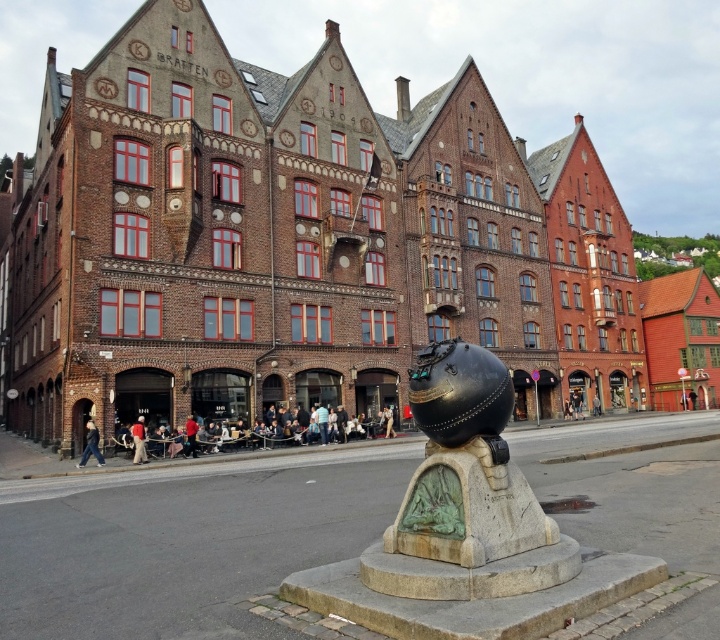
Question: Can you confirm if shiny black sphere at center is positioned to the left of dark blue jeans at center?

Choices:
 (A) yes
 (B) no

Answer: (B)

Question: Which is nearer to the shiny black sphere at center?

Choices:
 (A) red shirt at lower left
 (B) dark blue jeans at lower left

Answer: (A)

Question: Can you confirm if dark blue jeans at center is positioned above red shirt at lower left?

Choices:
 (A) yes
 (B) no

Answer: (B)

Question: Considering the real-world distances, which object is closest to the dark blue jeans at center?

Choices:
 (A) red shirt at lower left
 (B) shiny black sphere at center

Answer: (A)

Question: Which point appears closest to the camera in this image?

Choices:
 (A) (140, 419)
 (B) (78, 461)

Answer: (B)

Question: Can you confirm if dark blue jeans at center is positioned below red shirt at lower left?

Choices:
 (A) no
 (B) yes

Answer: (B)